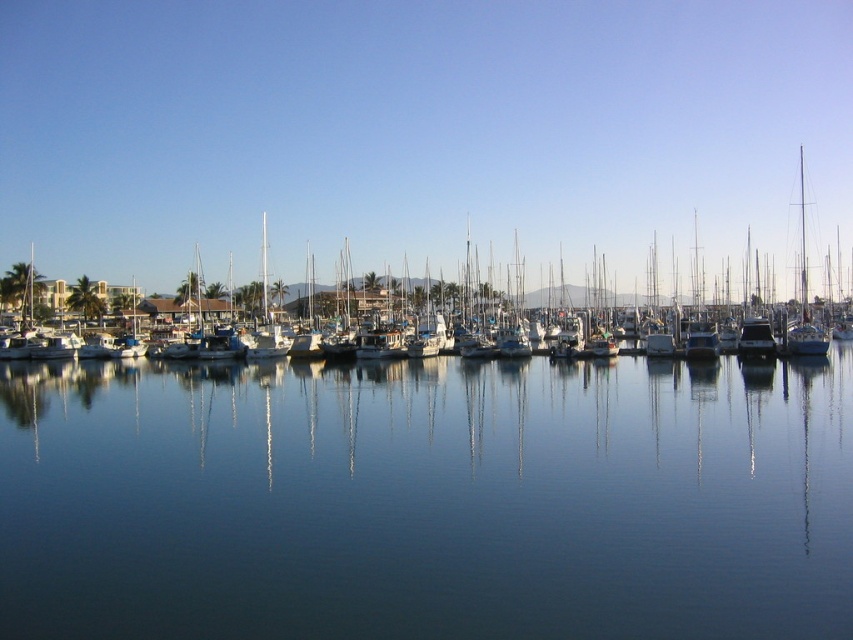
The width and height of the screenshot is (853, 640). What do you see at coordinates (427, 500) in the screenshot?
I see `transparent blue water at center` at bounding box center [427, 500].

The height and width of the screenshot is (640, 853). What are the coordinates of `transparent blue water at center` in the screenshot? It's located at (427, 500).

Identify the location of transparent blue water at center. The image size is (853, 640). (427, 500).

Which of these two, transparent blue water at center or white matte boats at center, stands taller?

Standing taller between the two is white matte boats at center.

Is point (358, 588) positioned before point (30, 323)?

Yes.

Find the location of a particular element. The height and width of the screenshot is (640, 853). transparent blue water at center is located at coordinates (427, 500).

Is white matte boats at center taller than white glossy sailboat at right?

In fact, white matte boats at center may be shorter than white glossy sailboat at right.

Does point (196, 257) lie in front of point (785, 342)?

That is False.

This screenshot has height=640, width=853. Identify the location of white matte boats at center. tap(189, 320).